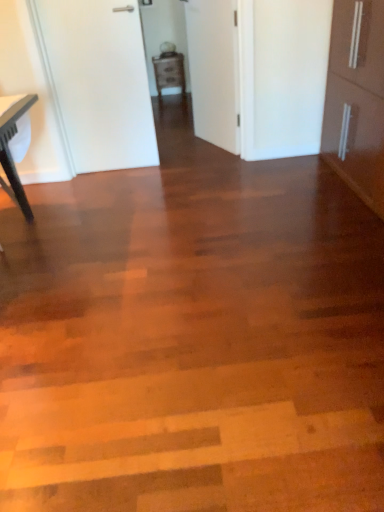
Locate an element on the screen. The width and height of the screenshot is (384, 512). vacant area that is in front of matte black table at left is located at coordinates (22, 256).